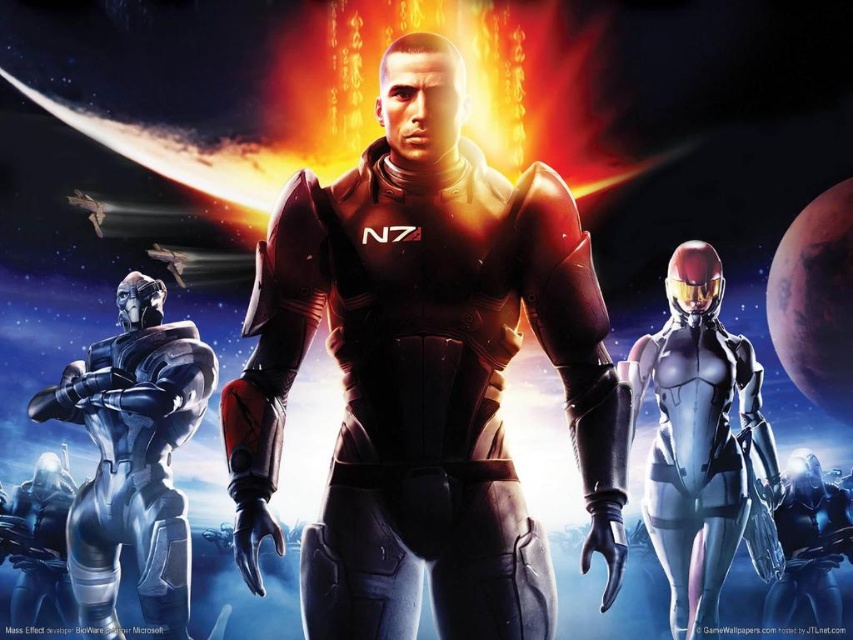
Can you confirm if shiny metallic armor at center is bigger than shiny silver armor at left?

Incorrect, shiny metallic armor at center is not larger than shiny silver armor at left.

Is shiny metallic armor at center shorter than shiny silver armor at left?

Correct, shiny metallic armor at center is not as tall as shiny silver armor at left.

What do you see at coordinates (425, 374) in the screenshot?
I see `shiny metallic armor at center` at bounding box center [425, 374].

Image resolution: width=853 pixels, height=640 pixels. In order to click on shiny metallic armor at center in this screenshot , I will do `click(425, 374)`.

Which of these two, shiny silver armor at left or metallic silver armor at right, stands shorter?

Standing shorter between the two is shiny silver armor at left.

Which is more to the right, shiny silver armor at left or metallic silver armor at right?

From the viewer's perspective, metallic silver armor at right appears more on the right side.

At what (x,y) coordinates should I click in order to perform the action: click on shiny silver armor at left. Please return your answer as a coordinate pair (x, y). Looking at the image, I should click on (132, 460).

Does shiny metallic armor at center have a smaller size compared to metallic silver armor at right?

Yes.

Does shiny metallic armor at center come in front of metallic silver armor at right?

Yes.

Identify the location of shiny metallic armor at center. The height and width of the screenshot is (640, 853). (425, 374).

Locate an element on the screen. shiny metallic armor at center is located at coordinates (425, 374).